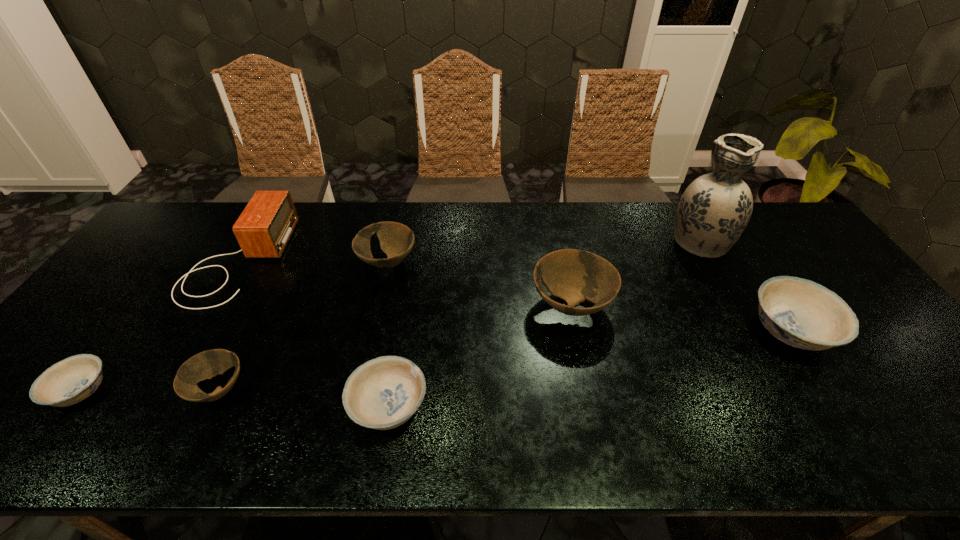
Find the location of a particular element. The height and width of the screenshot is (540, 960). object that is the fourth closest to the radio receiver is located at coordinates (383, 393).

Identify which object is located as the seventh nearest to the shortest object. Please provide its 2D coordinates. Your answer should be formatted as a tuple, i.e. [(x, y)], where the tuple contains the x and y coordinates of a point satisfying the conditions above.

[(801, 313)]

Identify the location of bowl that stands as the closest to the smallest blue bowl. The width and height of the screenshot is (960, 540). (207, 364).

Identify which bowl is the third nearest to the leftmost blue bowl. Please provide its 2D coordinates. Your answer should be formatted as a tuple, i.e. [(x, y)], where the tuple contains the x and y coordinates of a point satisfying the conditions above.

[(396, 240)]

In order to click on brown bowl that is the third closest one to the rightmost bowl in this screenshot , I will do `click(207, 364)`.

Where is `brown bowl identified as the closest to the vase`? Image resolution: width=960 pixels, height=540 pixels. brown bowl identified as the closest to the vase is located at coordinates (574, 275).

Identify the location of blue bowl that can be found as the closest to the rightmost bowl. The image size is (960, 540). (383, 393).

Point out which blue bowl is positioned as the nearest to the second blue bowl from left to right. Please provide its 2D coordinates. Your answer should be formatted as a tuple, i.e. [(x, y)], where the tuple contains the x and y coordinates of a point satisfying the conditions above.

[(74, 379)]

At what (x,y) coordinates should I click in order to perform the action: click on vacant area in the image that satisfies the following two spatial constraints: 1. on the front-facing side of the biggest brown bowl; 2. on the right side of the radio receiver. Please return your answer as a coordinate pair (x, y). Looking at the image, I should click on (210, 306).

Find the location of a particular element. This screenshot has height=540, width=960. blank space that satisfies the following two spatial constraints: 1. on the front side of the second biggest brown bowl; 2. on the left side of the second smallest blue bowl is located at coordinates (355, 407).